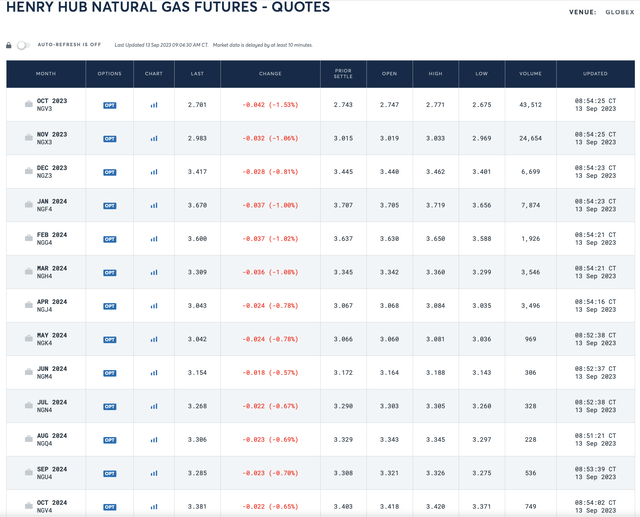
At what (x,y) coordinates should I click in order to perform the action: click on lock. Please return your answer as a coordinate pair (x, y). The image size is (640, 517). Looking at the image, I should click on (4, 45).